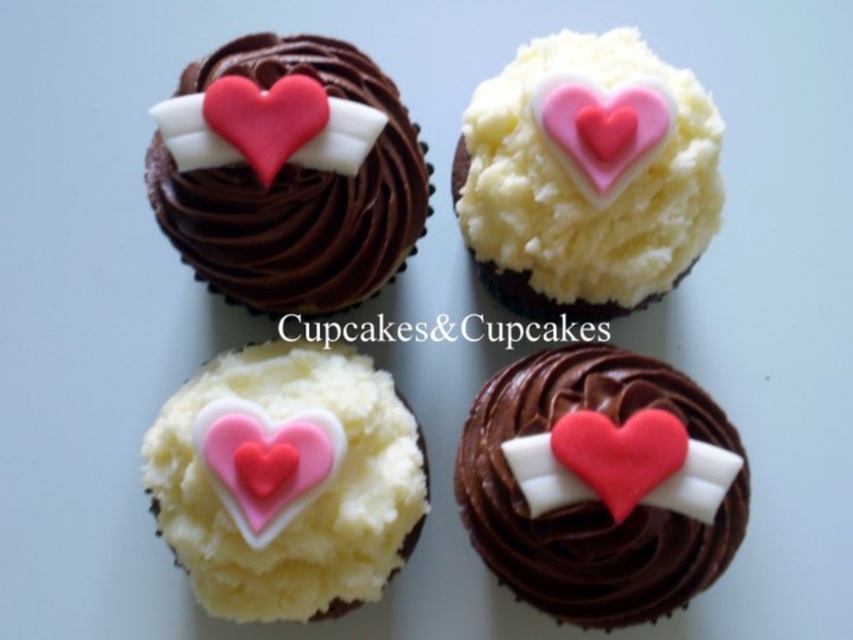
Question: Which object is positioned closest to the matte chocolate frosting at upper left?

Choices:
 (A) white fluffy cupcake at center
 (B) pink glossy heart at center
 (C) white fluffy cupcake at upper right

Answer: (C)

Question: Does white fluffy cupcake at center have a smaller size compared to pink glossy heart at center?

Choices:
 (A) no
 (B) yes

Answer: (A)

Question: Which object appears closest to the camera in this image?

Choices:
 (A) pink glossy heart at center
 (B) pink fondant heart at upper center
 (C) matte pink fondant heart at upper left
 (D) white fluffy cupcake at upper right

Answer: (A)

Question: Does pink glossy heart at center have a larger size compared to matte chocolate frosting at upper left?

Choices:
 (A) yes
 (B) no

Answer: (B)

Question: Is matte pink fondant heart at bottom right below matte pink fondant heart at upper left?

Choices:
 (A) yes
 (B) no

Answer: (A)

Question: Among these objects, which one is nearest to the camera?

Choices:
 (A) matte chocolate frosting at upper left
 (B) pink fondant heart at upper center

Answer: (A)